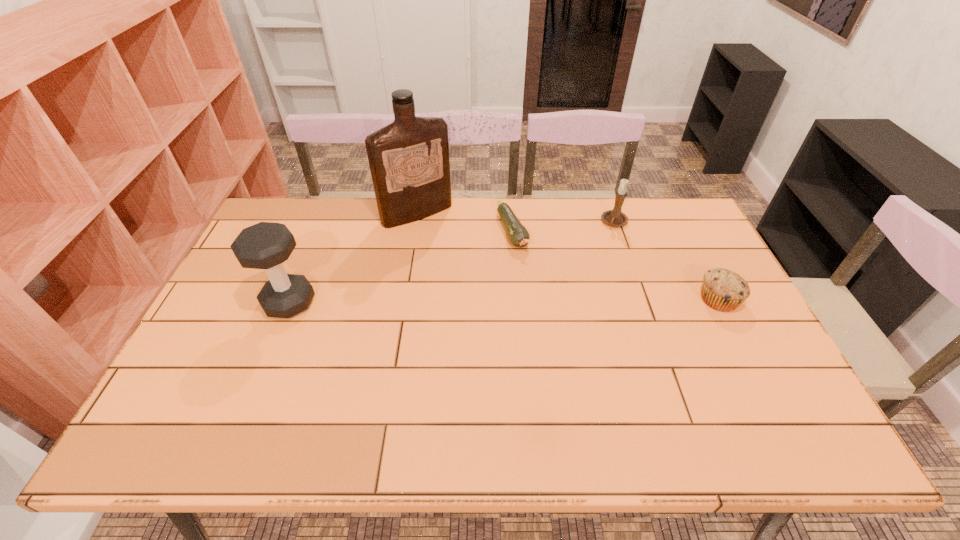
The height and width of the screenshot is (540, 960). What are the coordinates of `blank space located 0.110m on the left of the dumbbell` in the screenshot? It's located at (226, 302).

Where is `free location located 0.110m on the back of the rightmost object`? This screenshot has width=960, height=540. free location located 0.110m on the back of the rightmost object is located at coordinates (698, 259).

The height and width of the screenshot is (540, 960). Find the location of `free location located 0.140m on the label side of the liquor`. free location located 0.140m on the label side of the liquor is located at coordinates (452, 251).

Where is `vacant space located on the label side of the liquor`? This screenshot has height=540, width=960. vacant space located on the label side of the liquor is located at coordinates (443, 238).

Locate an element on the screen. This screenshot has width=960, height=540. vacant area located 0.380m on the label side of the liquor is located at coordinates (492, 298).

The image size is (960, 540). I want to click on free space located 0.240m at the blossom end of the shortest object, so click(542, 310).

Find the location of a particular element. The height and width of the screenshot is (540, 960). vacant space located at the blossom end of the shortest object is located at coordinates (555, 339).

Locate an element on the screen. Image resolution: width=960 pixels, height=540 pixels. blank area located 0.100m at the blossom end of the shortest object is located at coordinates (527, 276).

Image resolution: width=960 pixels, height=540 pixels. What are the coordinates of `vacant space located on the side of the candle holder with the handle` in the screenshot? It's located at (574, 283).

Image resolution: width=960 pixels, height=540 pixels. Identify the location of vacant area situated on the side of the candle holder with the handle. pyautogui.click(x=601, y=244).